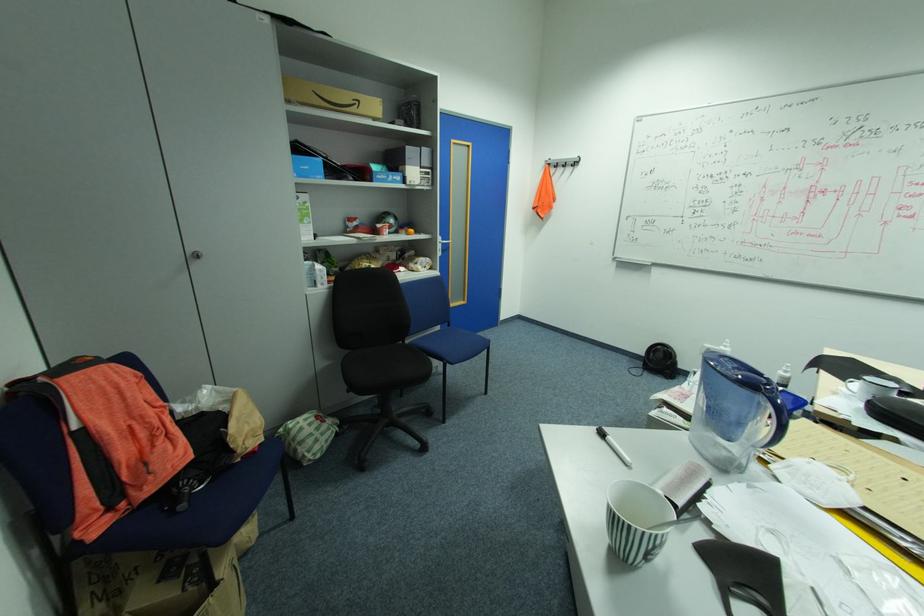
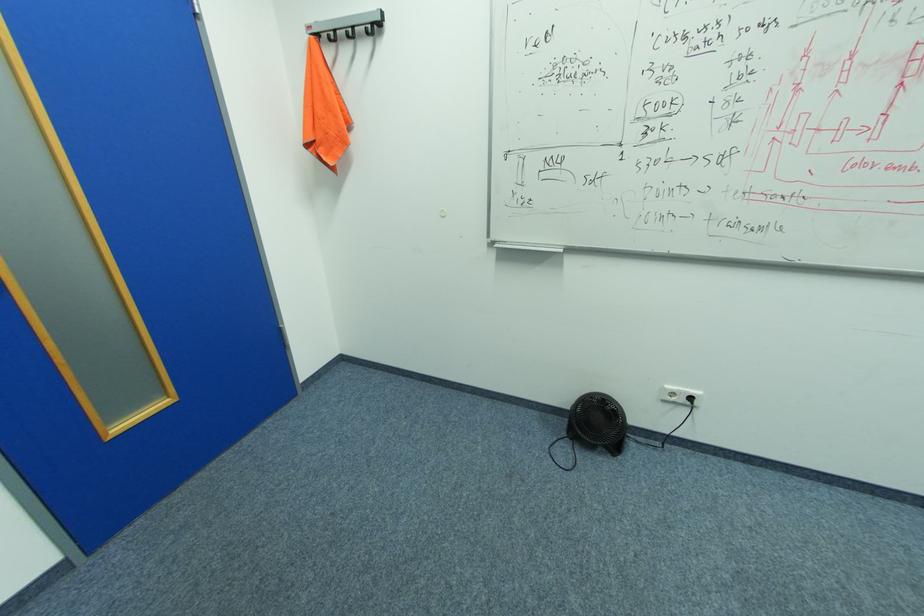
The point at (711, 346) is marked in the first image. Where is the corresponding point in the second image?

(670, 387)